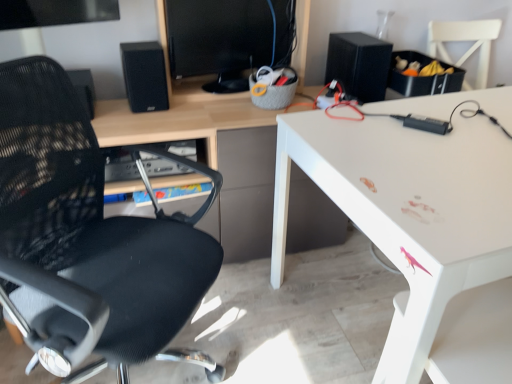
The height and width of the screenshot is (384, 512). What do you see at coordinates (228, 38) in the screenshot?
I see `black glossy monitor at upper center` at bounding box center [228, 38].

Where is `black matte speaker at upper left, marked as the second speaker in a right-to-left arrangement`? black matte speaker at upper left, marked as the second speaker in a right-to-left arrangement is located at coordinates (144, 76).

In order to face white glossy desk at upper right, should I rotate leftwards or rightwards?

Rotate right and turn 27.004 degrees.

This screenshot has height=384, width=512. What do you see at coordinates (359, 64) in the screenshot? I see `black matte speaker at upper right, the second speaker from the left` at bounding box center [359, 64].

The height and width of the screenshot is (384, 512). What are the coordinates of `black glossy monitor at upper center` in the screenshot? It's located at (228, 38).

From the image's perspective, is black mesh chair at left under black matte speaker at upper left, marked as the second speaker in a right-to-left arrangement?

Correct, black mesh chair at left appears lower than black matte speaker at upper left, marked as the second speaker in a right-to-left arrangement, in the image.

Is the depth of black mesh chair at left greater than that of black matte speaker at upper left, the 1th speaker positioned from the left?

No, the depth of black mesh chair at left is less than that of black matte speaker at upper left, the 1th speaker positioned from the left.

Considering the positions of objects black mesh chair at left and black matte speaker at upper left, the 1th speaker positioned from the left, in the image provided, who is more to the right, black mesh chair at left or black matte speaker at upper left, the 1th speaker positioned from the left,?

black mesh chair at left is more to the right.

From the picture: Which of these two, white glossy desk at upper right or black mesh chair at left, is thinner?

With smaller width is black mesh chair at left.

Which object is closer to the camera, white glossy desk at upper right or black mesh chair at left?

black mesh chair at left is more forward.

From the image's perspective, does white glossy desk at upper right appear lower than black mesh chair at left?

No, from the image's perspective, white glossy desk at upper right is not below black mesh chair at left.

How different are the orientations of white glossy desk at upper right and black mesh chair at left in degrees?

There is a 48.5-degree angle between the facing directions of white glossy desk at upper right and black mesh chair at left.

Can you tell me how much white glossy desk at upper right and black glossy monitor at upper center differ in facing direction?

There is a 8.48-degree angle between the facing directions of white glossy desk at upper right and black glossy monitor at upper center.

Which object is further away from the camera taking this photo, white glossy desk at upper right or black glossy monitor at upper center?

Positioned behind is black glossy monitor at upper center.

You are a GUI agent. You are given a task and a screenshot of the screen. Output one action in this format:
    pyautogui.click(x=<x>, y=<y>)
    Task: Click on the desk lying below the black glossy monitor at upper center (from the image's perspective)
    The height and width of the screenshot is (384, 512).
    Given the screenshot: What is the action you would take?
    pyautogui.click(x=420, y=232)

In the image, is white glossy desk at upper right on the left side or the right side of black glossy monitor at upper center?

From the image, it's evident that white glossy desk at upper right is to the right of black glossy monitor at upper center.

Is black mesh chair at left situated inside black glossy monitor at upper center or outside?

black mesh chair at left is located beyond the bounds of black glossy monitor at upper center.

Considering the sizes of black mesh chair at left and black glossy monitor at upper center in the image, is black mesh chair at left bigger or smaller than black glossy monitor at upper center?

black mesh chair at left is bigger than black glossy monitor at upper center.

Does point (173, 288) come behind point (206, 49)?

No.

Which is more to the right, black mesh chair at left or black glossy monitor at upper center?

black glossy monitor at upper center is more to the right.

From the image's perspective, which is above, black glossy monitor at upper center or white glossy desk at upper right?

black glossy monitor at upper center appears higher in the image.

Is black glossy monitor at upper center directly adjacent to white glossy desk at upper right?

No, black glossy monitor at upper center is not making contact with white glossy desk at upper right.

Does black glossy monitor at upper center have a greater width compared to white glossy desk at upper right?

Incorrect, the width of black glossy monitor at upper center does not surpass that of white glossy desk at upper right.

Considering the relative positions of black glossy monitor at upper center and white glossy desk at upper right in the image provided, is black glossy monitor at upper center to the right of white glossy desk at upper right from the viewer's perspective?

No.

From a real-world perspective, is white glossy desk at upper right physically located above or below black matte speaker at upper left, marked as the second speaker in a right-to-left arrangement?

white glossy desk at upper right is below black matte speaker at upper left, marked as the second speaker in a right-to-left arrangement.

From the image's perspective, is white glossy desk at upper right beneath black matte speaker at upper left, the 1th speaker positioned from the left?

Yes, from the image's perspective, white glossy desk at upper right is below black matte speaker at upper left, the 1th speaker positioned from the left.

Between point (48, 238) and point (359, 66), which one is positioned behind?

The point (359, 66) is farther from the camera.

In terms of size, does black mesh chair at left appear bigger or smaller than black matte speaker at upper right, the 1th speaker when ordered from right to left?

black mesh chair at left is bigger than black matte speaker at upper right, the 1th speaker when ordered from right to left.

At what (x,y) coordinates should I click in order to perform the action: click on chair that appears in front of the black matte speaker at upper right, the 1th speaker when ordered from right to left. Please return your answer as a coordinate pair (x, y). This screenshot has height=384, width=512. Looking at the image, I should click on (89, 240).

Is black mesh chair at left taller or shorter than black matte speaker at upper right, the 1th speaker when ordered from right to left?

Considering their sizes, black mesh chair at left has more height than black matte speaker at upper right, the 1th speaker when ordered from right to left.

Locate an element on the screen. the 2nd speaker located above the black mesh chair at left (from a real-world perspective) is located at coordinates (144, 76).

At what (x,y) coordinates should I click in order to perform the action: click on desk above the black mesh chair at left (from the image's perspective). Please return your answer as a coordinate pair (x, y). Looking at the image, I should click on (420, 232).

Estimate the real-world distances between objects in this image. Which object is further from black mesh chair at left, black glossy monitor at upper center or white glossy desk at upper right?

black glossy monitor at upper center is further to black mesh chair at left.

Which object lies further to the anchor point black matte speaker at upper right, the second speaker from the left, white glossy desk at upper right or black matte speaker at upper left, marked as the second speaker in a right-to-left arrangement?

black matte speaker at upper left, marked as the second speaker in a right-to-left arrangement, lies further to black matte speaker at upper right, the second speaker from the left, than the other object.

Based on their spatial positions, is black matte speaker at upper right, the 1th speaker when ordered from right to left, or black glossy monitor at upper center closer to white glossy desk at upper right?

The object closer to white glossy desk at upper right is black matte speaker at upper right, the 1th speaker when ordered from right to left.

Which object lies nearer to the anchor point black mesh chair at left, black glossy monitor at upper center or black matte speaker at upper left, the 1th speaker positioned from the left?

black matte speaker at upper left, the 1th speaker positioned from the left, is positioned closer to the anchor black mesh chair at left.

Based on their spatial positions, is black glossy monitor at upper center or black matte speaker at upper left, the 1th speaker positioned from the left, further from white glossy desk at upper right?

Among the two, black matte speaker at upper left, the 1th speaker positioned from the left, is located further to white glossy desk at upper right.

Looking at the image, which one is located further to black glossy monitor at upper center, white glossy desk at upper right or black matte speaker at upper right, the second speaker from the left?

white glossy desk at upper right is positioned further to the anchor black glossy monitor at upper center.

Which object lies nearer to the anchor point black matte speaker at upper right, the second speaker from the left, black mesh chair at left or black glossy monitor at upper center?

The object closer to black matte speaker at upper right, the second speaker from the left, is black glossy monitor at upper center.

From the image, which object appears to be farther from black glossy monitor at upper center, black mesh chair at left or white glossy desk at upper right?

Based on the image, white glossy desk at upper right appears to be further to black glossy monitor at upper center.

This screenshot has width=512, height=384. Find the location of `desk positioned between black mesh chair at left and black matte speaker at upper right, the second speaker from the left, from near to far`. desk positioned between black mesh chair at left and black matte speaker at upper right, the second speaker from the left, from near to far is located at coordinates (420, 232).

At what (x,y) coordinates should I click in order to perform the action: click on computer monitor situated between black mesh chair at left and white glossy desk at upper right from left to right. Please return your answer as a coordinate pair (x, y). This screenshot has height=384, width=512. Looking at the image, I should click on (228, 38).

Find the location of `computer monitor located between black mesh chair at left and black matte speaker at upper right, the second speaker from the left, in the depth direction`. computer monitor located between black mesh chair at left and black matte speaker at upper right, the second speaker from the left, in the depth direction is located at coordinates (228, 38).

Where is `chair between black matte speaker at upper left, marked as the second speaker in a right-to-left arrangement, and white glossy desk at upper right`? This screenshot has width=512, height=384. chair between black matte speaker at upper left, marked as the second speaker in a right-to-left arrangement, and white glossy desk at upper right is located at coordinates (89, 240).